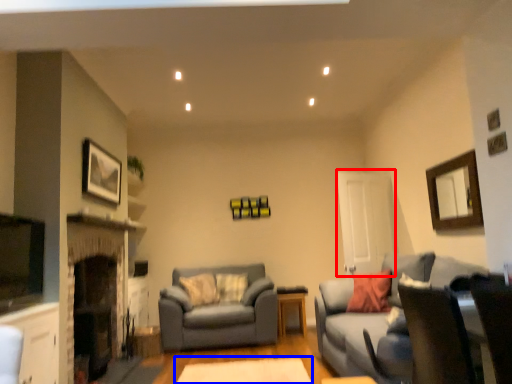
Question: Which object is further to the camera taking this photo, glass door (highlighted by a red box) or round table (highlighted by a blue box)?

Choices:
 (A) glass door
 (B) round table

Answer: (A)